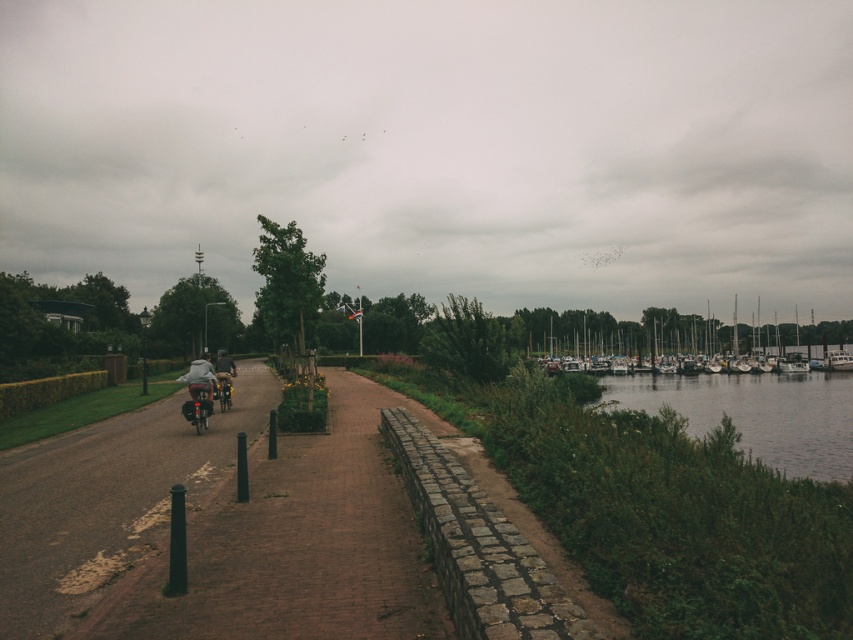
Does white matte boats at right come in front of matte black motorcycle at lower left?

No, it is not.

Who is more forward, (560, 346) or (193, 376)?

Point (193, 376)

Identify the location of white matte boats at right. (613, 328).

Does brown cobblestone path at center lie in front of white matte boats at right?

Yes, brown cobblestone path at center is in front of white matte boats at right.

Does brown cobblestone path at center have a larger size compared to white matte boats at right?

No, brown cobblestone path at center is not bigger than white matte boats at right.

Is point (405, 404) farther from camera compared to point (718, 324)?

That is False.

Find the location of `brown cobblestone path at center`. brown cobblestone path at center is located at coordinates (296, 544).

Who is more forward, [288,456] or [200,380]?

Result: Positioned in front is point [288,456].

Image resolution: width=853 pixels, height=640 pixels. Describe the element at coordinates (296, 544) in the screenshot. I see `brown cobblestone path at center` at that location.

Where is `brown cobblestone path at center`? brown cobblestone path at center is located at coordinates (296, 544).